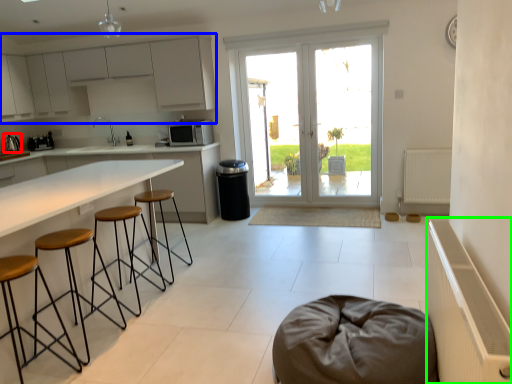
Question: Based on their relative distances, which object is nearer to appliance (highlighted by a red box)? Choose from cabinetry (highlighted by a blue box) and radiator (highlighted by a green box).

Choices:
 (A) cabinetry
 (B) radiator

Answer: (A)